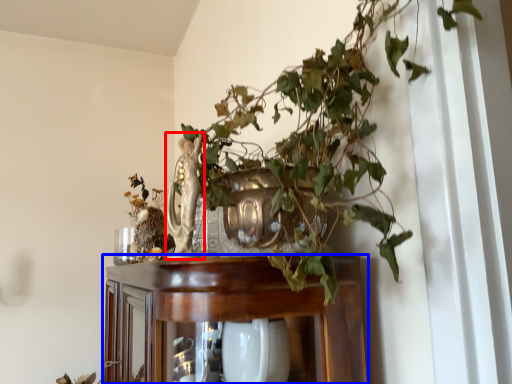
Question: Among these objects, which one is farthest to the camera, sculpture (highlighted by a red box) or furniture (highlighted by a blue box)?

Choices:
 (A) sculpture
 (B) furniture

Answer: (A)